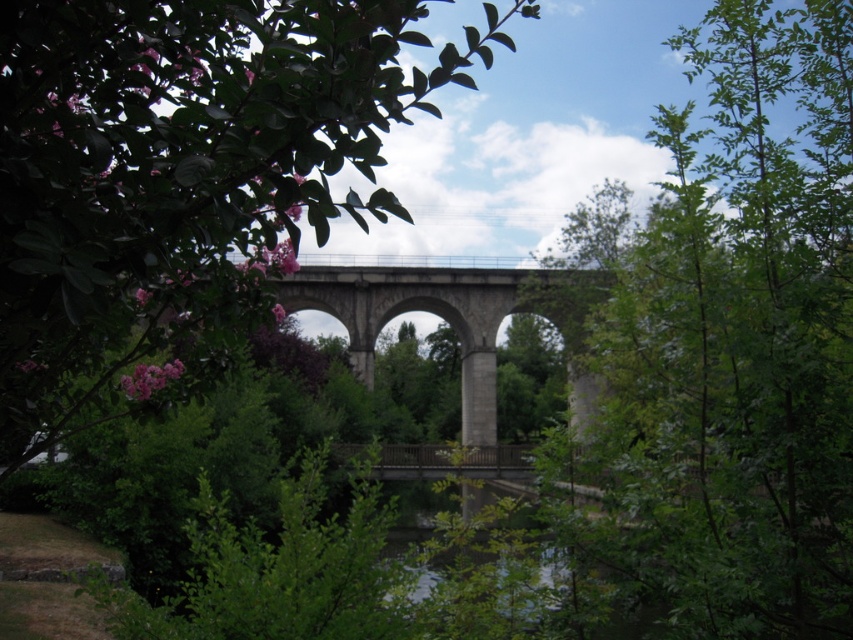
Is green leafy tree at upper center to the right of green leafy tree at center from the viewer's perspective?

No, green leafy tree at upper center is not to the right of green leafy tree at center.

Who is lower down, green leafy tree at upper center or green leafy tree at center?

Positioned lower is green leafy tree at center.

Between point (273, 177) and point (816, 310), which one is positioned in front?

Point (273, 177) is more forward.

Where is `green leafy tree at upper center`? This screenshot has width=853, height=640. green leafy tree at upper center is located at coordinates (178, 179).

Does green leafy tree at upper center come in front of gray stone bridge at center?

Yes, green leafy tree at upper center is closer to the viewer.

Measure the distance from green leafy tree at upper center to gray stone bridge at center.

green leafy tree at upper center is 94.12 feet away from gray stone bridge at center.

Locate an element on the screen. green leafy tree at upper center is located at coordinates (x=178, y=179).

Between green leafy tree at center and gray stone bridge at center, which one has less height?

Standing shorter between the two is gray stone bridge at center.

What do you see at coordinates (735, 346) in the screenshot? I see `green leafy tree at center` at bounding box center [735, 346].

Locate an element on the screen. The width and height of the screenshot is (853, 640). green leafy tree at center is located at coordinates (735, 346).